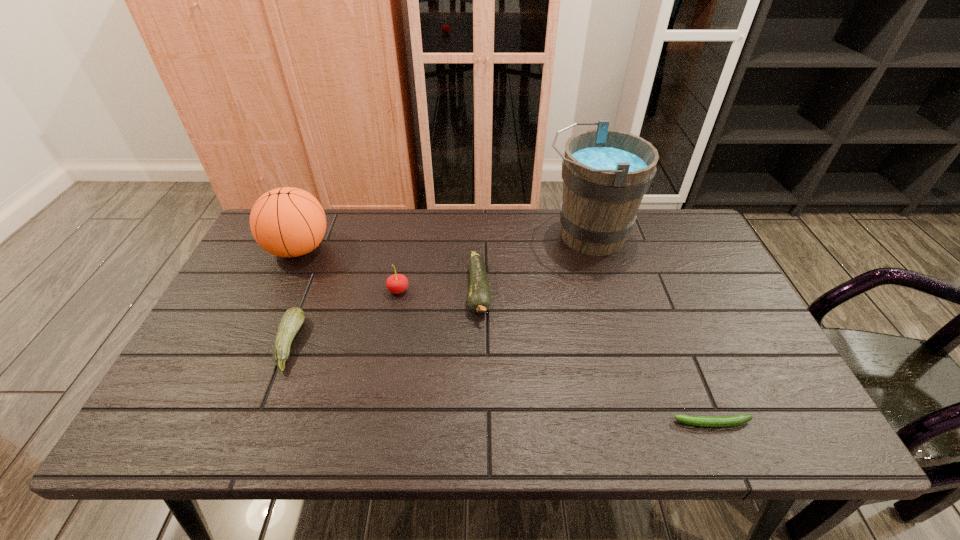
Identify the location of the tallest object. (605, 173).

I want to click on basketball, so click(287, 222).

Where is `the fourth object from right to left`? This screenshot has height=540, width=960. the fourth object from right to left is located at coordinates (397, 283).

Identify the location of cherry. (397, 283).

Locate an element on the screen. the tallest zucchini is located at coordinates (479, 295).

At what (x,y) coordinates should I click in order to perform the action: click on the third shortest object. Please return your answer as a coordinate pair (x, y). The width and height of the screenshot is (960, 540). Looking at the image, I should click on (479, 295).

I want to click on the second tallest zucchini, so click(291, 321).

Find the location of a particular element. The width and height of the screenshot is (960, 540). the leftmost zucchini is located at coordinates (291, 321).

Where is `the shortest zucchini`? This screenshot has height=540, width=960. the shortest zucchini is located at coordinates pyautogui.click(x=705, y=421).

Where is `the nearest zucchini`? This screenshot has width=960, height=540. the nearest zucchini is located at coordinates (705, 421).